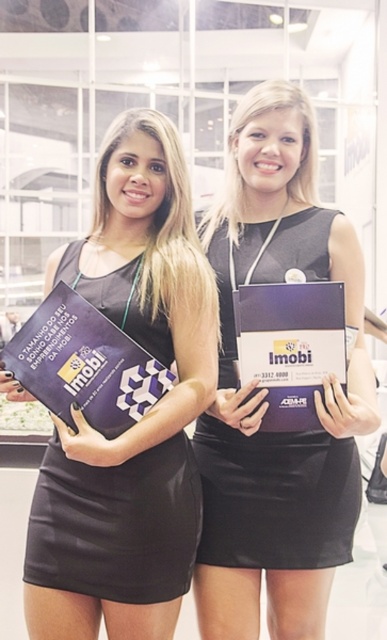
Can you confirm if purple matte booklet at center is positioned below matte purple booklet at center?

Yes, purple matte booklet at center is below matte purple booklet at center.

Between purple matte booklet at center and matte purple booklet at center, which one is positioned lower?

purple matte booklet at center is lower down.

Between point (118, 376) and point (294, 337), which one is positioned behind?

Positioned behind is point (294, 337).

Locate an element on the screen. purple matte booklet at center is located at coordinates (85, 364).

Find the location of a particular element. The width and height of the screenshot is (387, 640). black leather dress at center is located at coordinates (275, 497).

Does black leather dress at center have a greater width compared to matte purple booklet at center?

Correct, the width of black leather dress at center exceeds that of matte purple booklet at center.

Which is behind, point (323, 268) or point (304, 308)?

Positioned behind is point (323, 268).

Find the location of a particular element. The image size is (387, 640). black leather dress at center is located at coordinates (275, 497).

Does black leather dress at center come behind purple matte booklet at center?

Yes, it is behind purple matte booklet at center.

Is point (316, 476) positioned behind point (130, 406)?

Yes, it is.

Where is `black leather dress at center`? Image resolution: width=387 pixels, height=640 pixels. black leather dress at center is located at coordinates (275, 497).